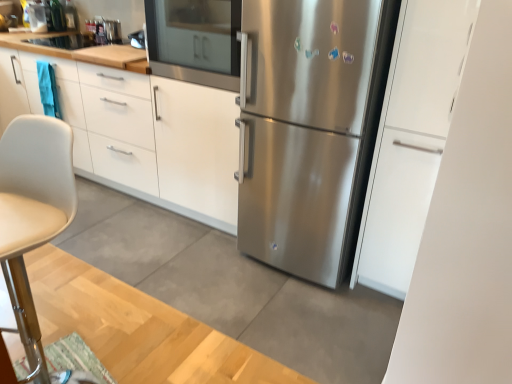
Locate an element on the screen. stainless steel oven at center is located at coordinates [195, 41].

The image size is (512, 384). I want to click on satin white cabinet at right, acting as the first cabinetry starting from the front, so click(x=411, y=139).

Image resolution: width=512 pixels, height=384 pixels. In order to click on stainless steel refrigerator at center in this screenshot , I will do click(310, 129).

The image size is (512, 384). Identify the location of stainless steel oven at center. (195, 41).

Which point is more forward, [7,182] or [422,53]?

Positioned in front is point [7,182].

Is there a large distance between beige leather chair at left and satin white cabinet at right, which is counted as the 1th cabinetry, starting from the right?

beige leather chair at left is positioned a significant distance from satin white cabinet at right, which is counted as the 1th cabinetry, starting from the right.

Based on the photo, how far apart are beige leather chair at left and satin white cabinet at right, which is the second cabinetry in left-to-right order?

They are 4.28 feet apart.

From the image's perspective, is beige leather chair at left beneath satin white cabinet at right, marked as the second cabinetry in a back-to-front arrangement?

Yes, from the image's perspective, beige leather chair at left is below satin white cabinet at right, marked as the second cabinetry in a back-to-front arrangement.

From the image's perspective, which one is positioned higher, satin white cabinet at right, marked as the second cabinetry in a back-to-front arrangement, or white matte cabinet at upper left, positioned as the 2th cabinetry in front-to-back order?

From the image's view, white matte cabinet at upper left, positioned as the 2th cabinetry in front-to-back order, is above.

Is satin white cabinet at right, which is counted as the 1th cabinetry, starting from the right, facing away from white matte cabinet at upper left, marked as the 1th cabinetry in a back-to-front arrangement?

No, white matte cabinet at upper left, marked as the 1th cabinetry in a back-to-front arrangement, is not at the back of satin white cabinet at right, which is counted as the 1th cabinetry, starting from the right.

Locate an element on the screen. This screenshot has height=384, width=512. cabinetry above the white matte cabinet at upper left, positioned as the 2th cabinetry in front-to-back order (from a real-world perspective) is located at coordinates (411, 139).

Which object is positioned more to the left, stainless steel refrigerator at center or beige leather chair at left?

beige leather chair at left.

Are stainless steel refrigerator at center and beige leather chair at left far apart?

Yes.

Is point (344, 247) positioned before point (31, 138)?

No, (344, 247) is further to viewer.

Which is behind, stainless steel refrigerator at center or beige leather chair at left?

Positioned behind is stainless steel refrigerator at center.

Considering the relative sizes of stainless steel oven at center and satin white cabinet at right, marked as the second cabinetry in a back-to-front arrangement, in the image provided, is stainless steel oven at center thinner than satin white cabinet at right, marked as the second cabinetry in a back-to-front arrangement,?

In fact, stainless steel oven at center might be wider than satin white cabinet at right, marked as the second cabinetry in a back-to-front arrangement.

From a real-world perspective, is stainless steel oven at center positioned over satin white cabinet at right, which is the second cabinetry in left-to-right order, based on gravity?

Yes, from a real-world perspective, stainless steel oven at center is over satin white cabinet at right, which is the second cabinetry in left-to-right order

From the image's perspective, which cabinetry is the 2nd one below the stainless steel oven at center? Please provide its 2D coordinates.

[(411, 139)]

Who is shorter, stainless steel oven at center or satin white cabinet at right, acting as the first cabinetry starting from the front?

With less height is stainless steel oven at center.

Between white matte cabinet at upper left, marked as the 1th cabinetry in a back-to-front arrangement, and beige leather chair at left, which one has more height?

Standing taller between the two is beige leather chair at left.

Is white matte cabinet at upper left, the second cabinetry in the right-to-left sequence, not inside beige leather chair at left?

white matte cabinet at upper left, the second cabinetry in the right-to-left sequence, is positioned outside beige leather chair at left.

Is point (165, 176) behind point (16, 277)?

Yes.

Consider the image. From a real-world perspective, who is located higher, white matte cabinet at upper left, positioned as the 2th cabinetry in front-to-back order, or beige leather chair at left?

beige leather chair at left.

I want to click on oven that is above the stainless steel refrigerator at center (from the image's perspective), so click(195, 41).

Considering the points (321, 233) and (161, 34), which point is in front, point (321, 233) or point (161, 34)?

The point (321, 233) is in front.

Is stainless steel refrigerator at center positioned far away from stainless steel oven at center?

Actually, stainless steel refrigerator at center and stainless steel oven at center are a little close together.

From a real-world perspective, is stainless steel refrigerator at center positioned above or below stainless steel oven at center?

stainless steel refrigerator at center is situated lower than stainless steel oven at center in the real world.

Can you confirm if stainless steel refrigerator at center is thinner than white matte cabinet at upper left, marked as the 1th cabinetry in a back-to-front arrangement?

Incorrect, the width of stainless steel refrigerator at center is not less than that of white matte cabinet at upper left, marked as the 1th cabinetry in a back-to-front arrangement.

Is stainless steel refrigerator at center in contact with white matte cabinet at upper left, positioned as the 2th cabinetry in front-to-back order?

No.

Which is correct: stainless steel refrigerator at center is inside white matte cabinet at upper left, positioned as the 2th cabinetry in front-to-back order, or outside of it?

stainless steel refrigerator at center is outside white matte cabinet at upper left, positioned as the 2th cabinetry in front-to-back order.

Between stainless steel refrigerator at center and white matte cabinet at upper left, the second cabinetry in the right-to-left sequence, which one is positioned behind?

white matte cabinet at upper left, the second cabinetry in the right-to-left sequence.

From the image's perspective, which cabinetry is the 1st one above the beige leather chair at left? Please provide its 2D coordinates.

[(411, 139)]

Identify the location of cabinetry directly beneath the satin white cabinet at right, acting as the first cabinetry starting from the front (from a real-world perspective). (134, 126).

When comparing their distances from satin white cabinet at right, acting as the first cabinetry starting from the front, does stainless steel oven at center or beige leather chair at left seem further?

Among the two, beige leather chair at left is located further to satin white cabinet at right, acting as the first cabinetry starting from the front.

When comparing their distances from stainless steel oven at center, does satin white cabinet at right, acting as the first cabinetry starting from the front, or white matte cabinet at upper left, the second cabinetry in the right-to-left sequence, seem closer?

The object closer to stainless steel oven at center is white matte cabinet at upper left, the second cabinetry in the right-to-left sequence.

From the image, which object appears to be nearer to beige leather chair at left, stainless steel refrigerator at center or satin white cabinet at right, acting as the first cabinetry starting from the front?

stainless steel refrigerator at center is positioned closer to the anchor beige leather chair at left.

When comparing their distances from stainless steel oven at center, does beige leather chair at left or white matte cabinet at upper left, marked as the 1th cabinetry in a back-to-front arrangement, seem closer?

white matte cabinet at upper left, marked as the 1th cabinetry in a back-to-front arrangement, is positioned closer to the anchor stainless steel oven at center.

Considering their positions, is stainless steel oven at center positioned further to stainless steel refrigerator at center than beige leather chair at left?

beige leather chair at left is further to stainless steel refrigerator at center.

Estimate the real-world distances between objects in this image. Which object is closer to stainless steel oven at center, beige leather chair at left or stainless steel refrigerator at center?

stainless steel refrigerator at center lies closer to stainless steel oven at center than the other object.

Which object lies nearer to the anchor point beige leather chair at left, satin white cabinet at right, marked as the second cabinetry in a back-to-front arrangement, or stainless steel refrigerator at center?

stainless steel refrigerator at center is positioned closer to the anchor beige leather chair at left.

From the image, which object appears to be nearer to white matte cabinet at upper left, positioned as the 2th cabinetry in front-to-back order, beige leather chair at left or stainless steel oven at center?

stainless steel oven at center is closer to white matte cabinet at upper left, positioned as the 2th cabinetry in front-to-back order.

At what (x,y) coordinates should I click in order to perform the action: click on oven located between white matte cabinet at upper left, positioned as the 2th cabinetry in front-to-back order, and satin white cabinet at right, which is the second cabinetry in left-to-right order, in the left-right direction. Please return your answer as a coordinate pair (x, y). The image size is (512, 384). Looking at the image, I should click on (195, 41).

This screenshot has height=384, width=512. I want to click on refrigerator situated between beige leather chair at left and satin white cabinet at right, which is the second cabinetry in left-to-right order, from left to right, so click(310, 129).

The height and width of the screenshot is (384, 512). In order to click on oven between white matte cabinet at upper left, positioned as the 2th cabinetry in front-to-back order, and stainless steel refrigerator at center in this screenshot , I will do `click(195, 41)`.

Identify the location of oven between beige leather chair at left and satin white cabinet at right, acting as the first cabinetry starting from the front. This screenshot has height=384, width=512. (195, 41).